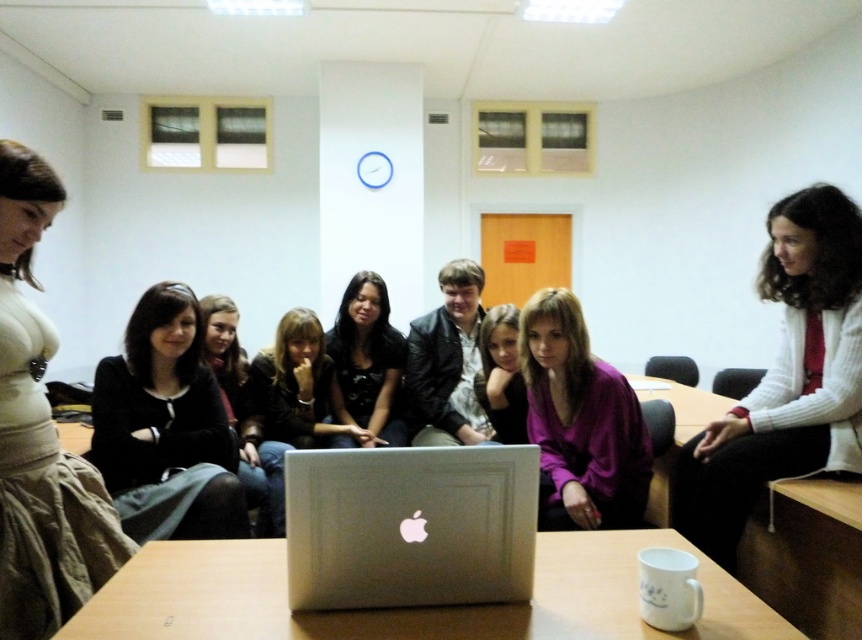
You are organizing a clothing donation drive and need to determine which items are suitable for adult sizes. Looking at the white textured sweater at left and the matte black shirt at center, which one is more likely to fit an adult?

The white textured sweater at left is larger in size than the matte black shirt at center, so it is more likely to fit an adult.